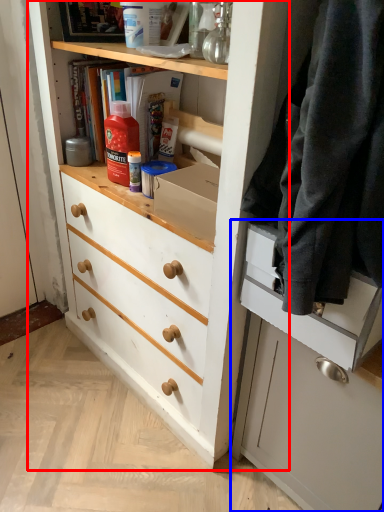
Question: Which point is further to the camera, chest of drawers (highlighted by a red box) or cabinetry (highlighted by a blue box)?

Choices:
 (A) chest of drawers
 (B) cabinetry

Answer: (B)